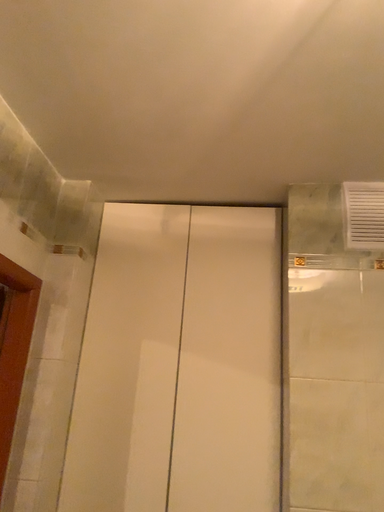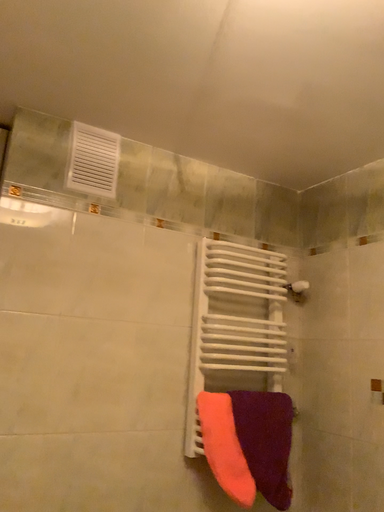
Question: How did the camera likely rotate when shooting the video?

Choices:
 (A) rotated downward
 (B) rotated upward

Answer: (A)